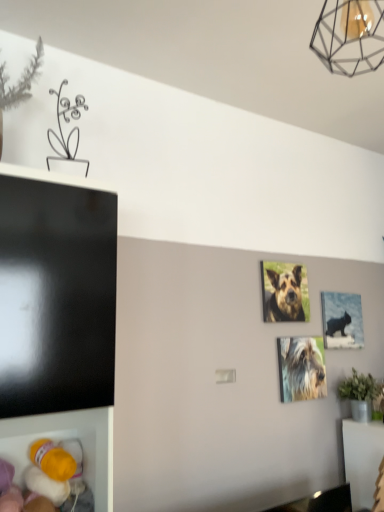
Question: Considering the positions of metallic wireframe lamp at upper right and metallic silver picture frame at center-right in the image, is metallic wireframe lamp at upper right wider or thinner than metallic silver picture frame at center-right?

Choices:
 (A) wide
 (B) thin

Answer: (A)

Question: Considering the positions of point (360, 41) and point (347, 293), is point (360, 41) closer or farther from the camera than point (347, 293)?

Choices:
 (A) closer
 (B) farther

Answer: (A)

Question: Considering the real-world distances, which object is farthest from the metallic wireframe lamp at upper right?

Choices:
 (A) brown fur dog at center, marked as the 2th dog in a bottom-to-top arrangement
 (B) shaggy fur dog at center, the second dog in the top-to-bottom sequence
 (C) metallic silver picture frame at center-right

Answer: (B)

Question: Based on their relative distances, which object is nearer to the shaggy fur dog at center, the second dog in the top-to-bottom sequence?

Choices:
 (A) metallic wireframe lamp at upper right
 (B) metallic silver picture frame at center-right
 (C) brown fur dog at center, marked as the 2th dog in a bottom-to-top arrangement

Answer: (C)